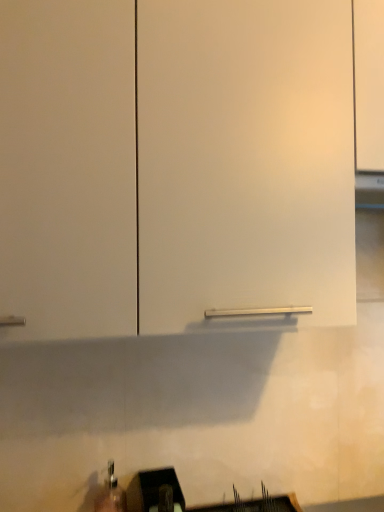
The width and height of the screenshot is (384, 512). Describe the element at coordinates (245, 158) in the screenshot. I see `white matte cabinet at center` at that location.

This screenshot has width=384, height=512. I want to click on white matte cabinet at center, so click(x=245, y=158).

The image size is (384, 512). In order to click on black plastic sink at lower center in this screenshot , I will do `click(181, 497)`.

Image resolution: width=384 pixels, height=512 pixels. What do you see at coordinates (181, 497) in the screenshot? I see `black plastic sink at lower center` at bounding box center [181, 497].

Locate an element on the screen. white matte cabinet at center is located at coordinates (245, 158).

Is black plastic sink at lower center to the right of white matte cabinet at center from the viewer's perspective?

In fact, black plastic sink at lower center is to the left of white matte cabinet at center.

Considering the relative positions of black plastic sink at lower center and white matte cabinet at center in the image provided, is black plastic sink at lower center in front of white matte cabinet at center?

That is False.

Which point is more distant from viewer, (271,498) or (260,25)?

Point (271,498)

From the image's perspective, is black plastic sink at lower center above or below white matte cabinet at center?

Based on their image positions, black plastic sink at lower center is located beneath white matte cabinet at center.

From a real-world perspective, which object stands above the other?

From a 3D spatial view, white matte cabinet at center is above.

Does black plastic sink at lower center have a lesser width compared to white matte cabinet at center?

Correct, the width of black plastic sink at lower center is less than that of white matte cabinet at center.

Which of these two, black plastic sink at lower center or white matte cabinet at center, stands shorter?

black plastic sink at lower center.

Which of these two, black plastic sink at lower center or white matte cabinet at center, is bigger?

With larger size is white matte cabinet at center.

Is black plastic sink at lower center positioned beyond the bounds of white matte cabinet at center?

Absolutely, black plastic sink at lower center is external to white matte cabinet at center.

From the picture: Are black plastic sink at lower center and white matte cabinet at center located far from each other?

No, black plastic sink at lower center is not far away from white matte cabinet at center.

Is black plastic sink at lower center turned away from white matte cabinet at center?

black plastic sink at lower center does not have its back to white matte cabinet at center.

The image size is (384, 512). I want to click on sink below the white matte cabinet at center (from the image's perspective), so click(181, 497).

Would you say white matte cabinet at center is to the left or to the right of black plastic sink at lower center in the picture?

In the image, white matte cabinet at center appears on the right side of black plastic sink at lower center.

Is white matte cabinet at center positioned behind black plastic sink at lower center?

No, it is in front of black plastic sink at lower center.

Is point (180, 85) positioned in front of point (238, 497)?

Yes, point (180, 85) is in front of point (238, 497).

From the image's perspective, does white matte cabinet at center appear lower than black plastic sink at lower center?

No, from the image's perspective, white matte cabinet at center is not beneath black plastic sink at lower center.

Consider the image. From a real-world perspective, between white matte cabinet at center and black plastic sink at lower center, who is vertically higher?

white matte cabinet at center.

Between white matte cabinet at center and black plastic sink at lower center, which one has smaller width?

With smaller width is black plastic sink at lower center.

Considering the sizes of objects white matte cabinet at center and black plastic sink at lower center in the image provided, who is taller, white matte cabinet at center or black plastic sink at lower center?

With more height is white matte cabinet at center.

Between white matte cabinet at center and black plastic sink at lower center, which one has smaller size?

black plastic sink at lower center is smaller.

Could black plastic sink at lower center be considered to be inside white matte cabinet at center?

No.

In the scene shown: Are white matte cabinet at center and black plastic sink at lower center beside each other?

No, white matte cabinet at center is not next to black plastic sink at lower center.

Is white matte cabinet at center oriented away from black plastic sink at lower center?

No, white matte cabinet at center is not facing the opposite direction of black plastic sink at lower center.

Locate an element on the screen. The height and width of the screenshot is (512, 384). cabinetry in front of the black plastic sink at lower center is located at coordinates (245, 158).

Locate an element on the screen. This screenshot has width=384, height=512. sink on the left of white matte cabinet at center is located at coordinates (181, 497).

At what (x,y) coordinates should I click in order to perform the action: click on sink located underneath the white matte cabinet at center (from a real-world perspective). Please return your answer as a coordinate pair (x, y). Looking at the image, I should click on (181, 497).